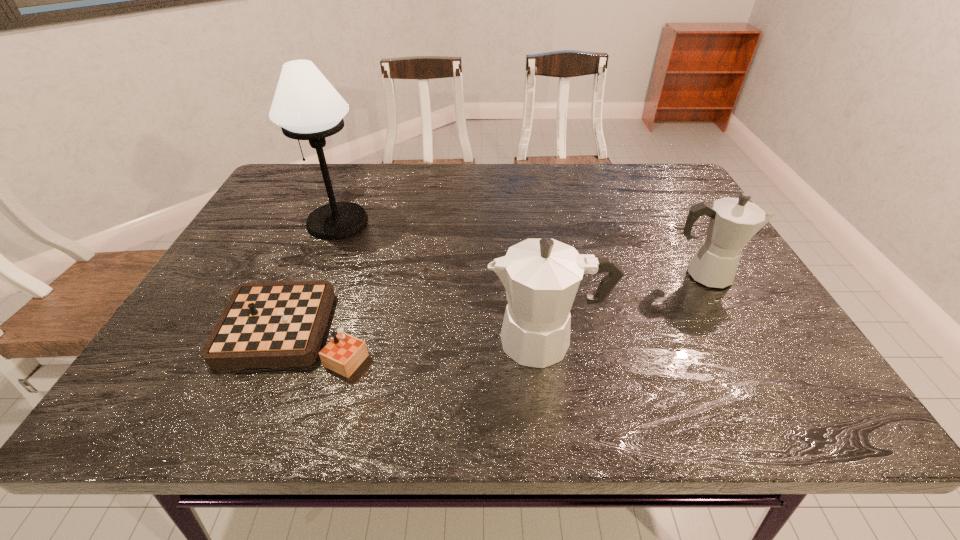
Where is `the tallest object`? Image resolution: width=960 pixels, height=540 pixels. the tallest object is located at coordinates (307, 107).

At what (x,y) coordinates should I click in order to perform the action: click on table lamp. Please return your answer as a coordinate pair (x, y). This screenshot has width=960, height=540. Looking at the image, I should click on (307, 107).

Where is `the nearer coffeepot`? the nearer coffeepot is located at coordinates (541, 276).

Locate an element on the screen. the left coffeepot is located at coordinates (541, 276).

Where is `the third nearest object`? This screenshot has width=960, height=540. the third nearest object is located at coordinates (733, 222).

Image resolution: width=960 pixels, height=540 pixels. What are the coordinates of `the right coffeepot` in the screenshot? It's located at (733, 222).

Identify the location of chessboard. (270, 324).

Where is `vacant position located on the right of the farthest object`? vacant position located on the right of the farthest object is located at coordinates (409, 222).

Where is `vacant position located 0.120m at the spout of the nearer coffeepot`? This screenshot has height=540, width=960. vacant position located 0.120m at the spout of the nearer coffeepot is located at coordinates (429, 341).

Where is `free space located at the spout of the nearer coffeepot`? free space located at the spout of the nearer coffeepot is located at coordinates pos(347,341).